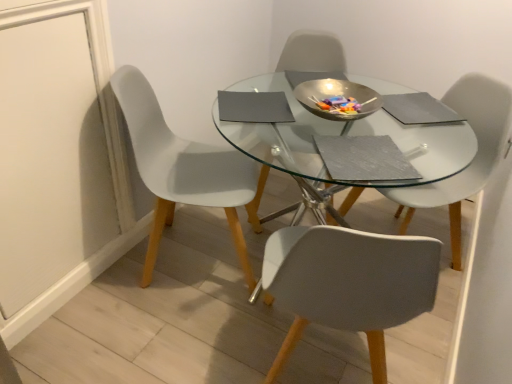
This screenshot has width=512, height=384. Identify the location of free space in front of white plastic chair at left, which ranks as the 1th chair in left-to-right order. (150, 335).